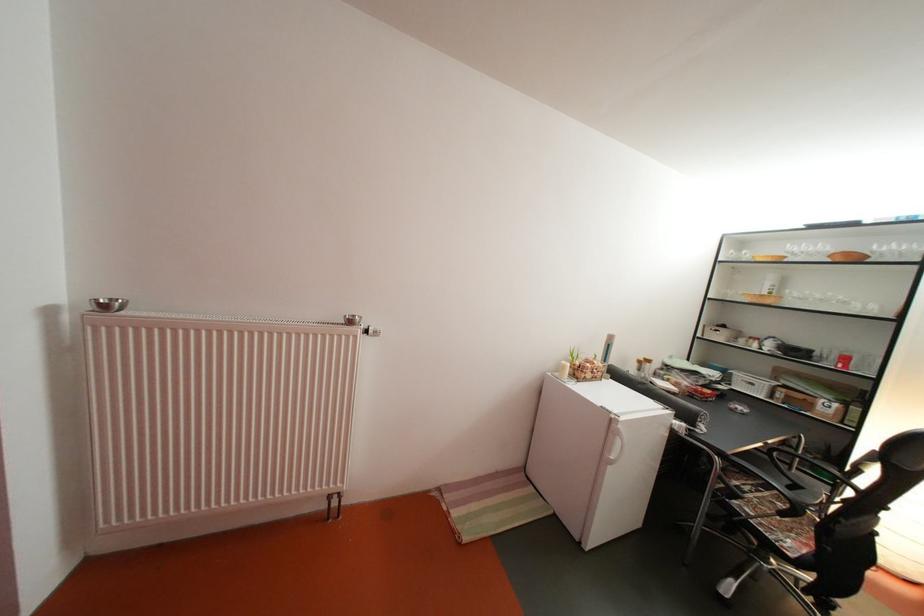
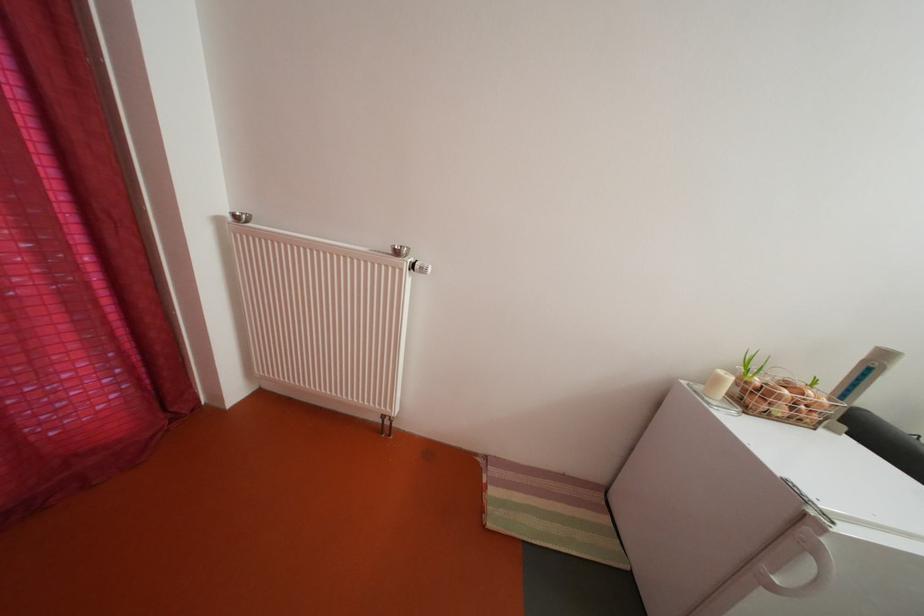
Where in the second image is the point corresponding to pixel 623 469 from the first image?

(784, 594)